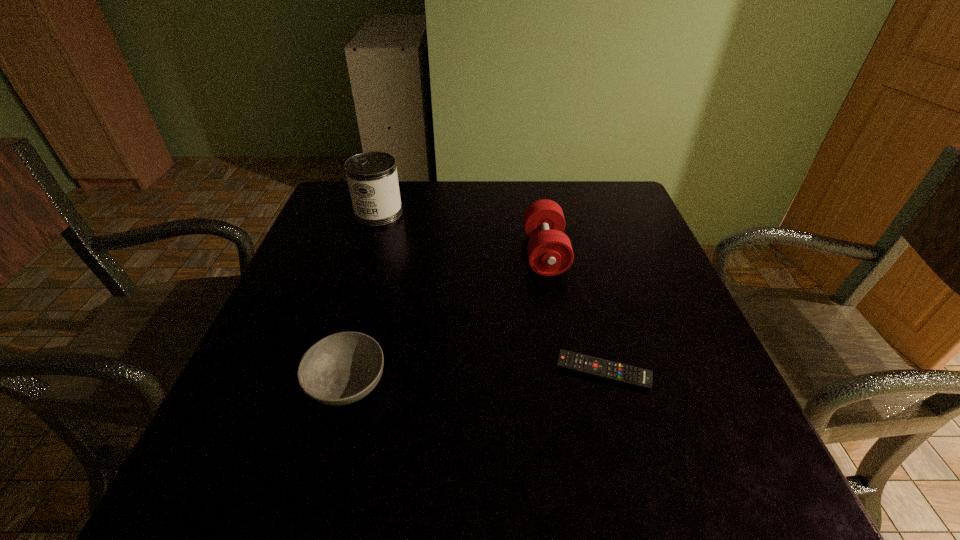
What are the coordinates of `blank area at the near right corner` in the screenshot? It's located at (737, 444).

The image size is (960, 540). In order to click on vacant point located between the second farthest object and the farthest object in this screenshot , I will do `click(462, 233)`.

You are a GUI agent. You are given a task and a screenshot of the screen. Output one action in this format:
    pyautogui.click(x=<x>, y=<y>)
    Task: Click on the unoccupied position between the bowl and the remote control
    The height and width of the screenshot is (540, 960).
    Given the screenshot: What is the action you would take?
    pyautogui.click(x=475, y=377)

This screenshot has width=960, height=540. I want to click on vacant space in between the tallest object and the third tallest object, so click(363, 298).

Identify the location of free space between the farthest object and the remote control. (491, 292).

Identify the location of free space between the remote control and the bowl. Image resolution: width=960 pixels, height=540 pixels. (x=475, y=377).

The height and width of the screenshot is (540, 960). In order to click on unoccupied area between the can and the shortest object in this screenshot , I will do `click(491, 292)`.

Image resolution: width=960 pixels, height=540 pixels. In order to click on unoccupied position between the can and the second tallest object in this screenshot , I will do `click(462, 233)`.

I want to click on empty space between the third tallest object and the farthest object, so click(363, 298).

This screenshot has height=540, width=960. I want to click on free point between the bowl and the remote control, so click(x=475, y=377).